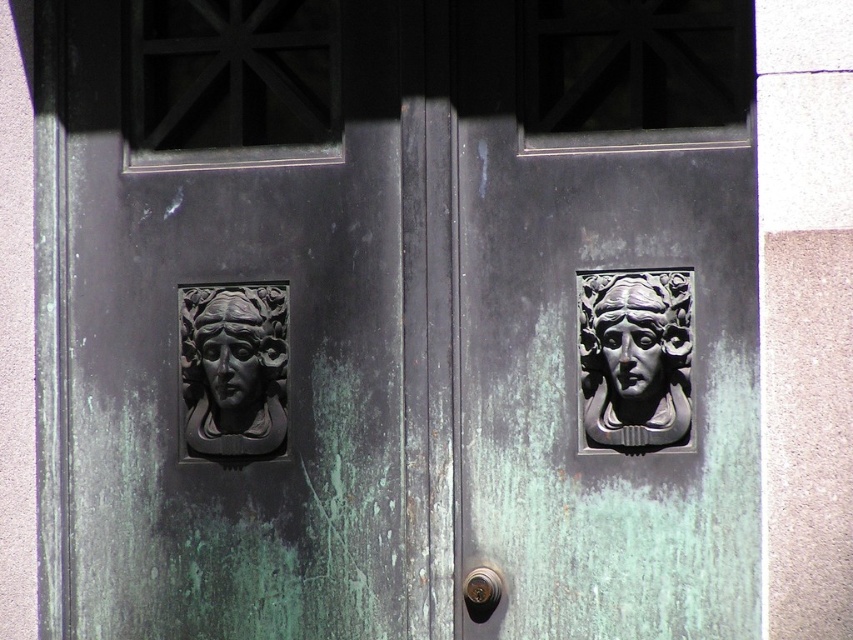
Consider the image. You are standing in front of the door and want to locate the bronze sculpture at right and the polished brass knob at center. Which object is positioned to the right of the other?

The bronze sculpture at right is to the right of the polished brass knob at center.

You are an art conservator examining the door. You need to clean the matte bronze mask at right and the matte black relief at left. Which object is positioned to the right of the other?

The matte bronze mask at right is to the right of the matte black relief at left.